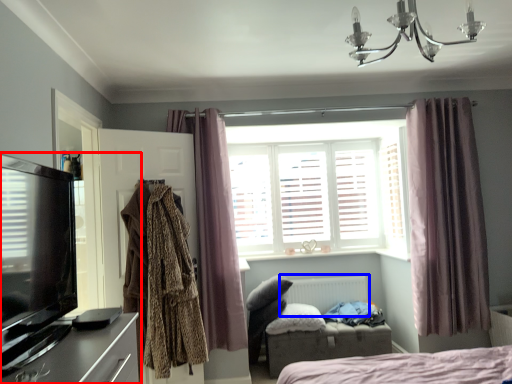
Question: Which point is further to the camera, entertainment center (highlighted by a red box) or radiator (highlighted by a blue box)?

Choices:
 (A) entertainment center
 (B) radiator

Answer: (B)